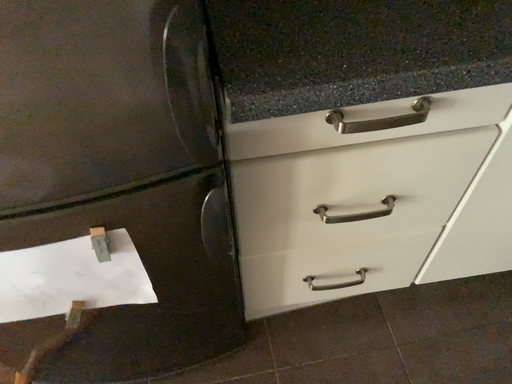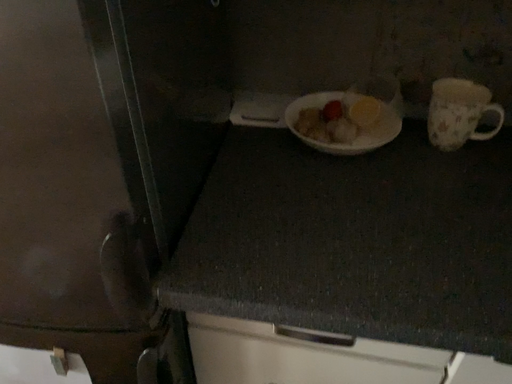
Question: Which way did the camera rotate in the video?

Choices:
 (A) rotated left
 (B) rotated right

Answer: (A)